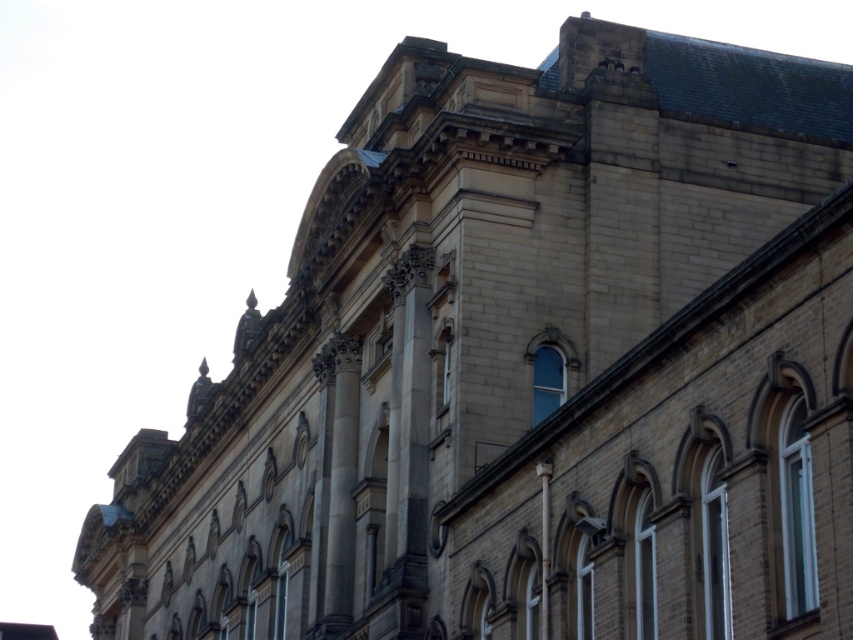
Is clear glass window at upper center above clear glass window at center?

No.

At what (x,y) coordinates should I click in order to perform the action: click on clear glass window at upper center. Please return your answer as a coordinate pair (x, y). This screenshot has width=853, height=640. Looking at the image, I should click on (546, 381).

Identify the location of clear glass window at upper center. (546, 381).

How much distance is there between brown brick window at center-right and white plastic window at right?

The distance of brown brick window at center-right from white plastic window at right is 1.24 inches.

Which of these two, brown brick window at center-right or white plastic window at right, stands shorter?

white plastic window at right

Between point (790, 365) and point (809, 588), which one is positioned behind?

Positioned behind is point (790, 365).

The height and width of the screenshot is (640, 853). Identify the location of brown brick window at center-right. (798, 512).

Who is positioned more to the left, brown brick window at center-right or clear glass window at upper center?

Positioned to the left is clear glass window at upper center.

Measure the distance between brown brick window at center-right and clear glass window at upper center.

brown brick window at center-right is 65.00 feet from clear glass window at upper center.

Where is `brown brick window at center-right`? brown brick window at center-right is located at coordinates (798, 512).

Where is `brown brick window at center-right`? The height and width of the screenshot is (640, 853). brown brick window at center-right is located at coordinates (798, 512).